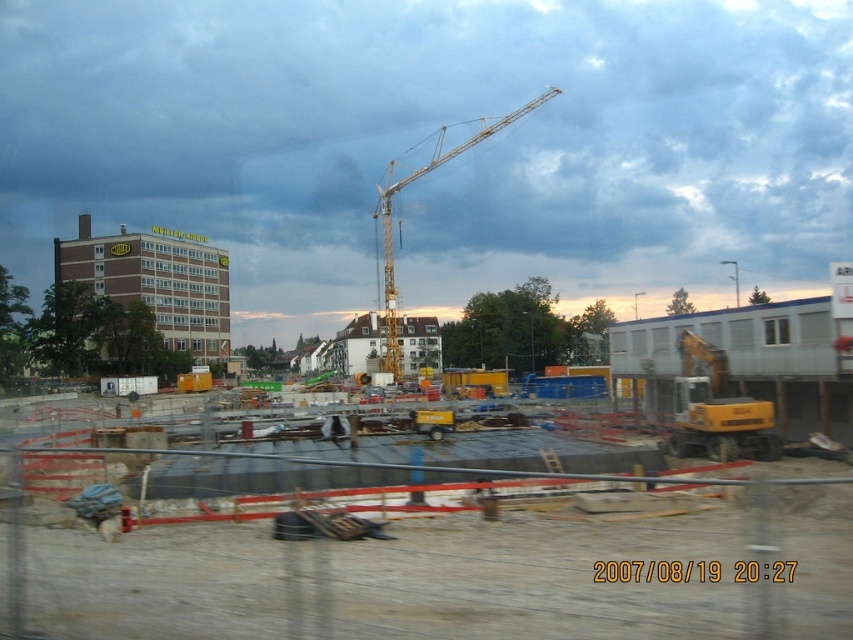
Question: Based on their relative distances, which object is farther from the black plastic website at center?

Choices:
 (A) brown brick building at left
 (B) yellow metallic truck at center

Answer: (A)

Question: Which point is farther to the camera?

Choices:
 (A) (178, 241)
 (B) (686, 579)
 (C) (543, 93)
 (D) (396, 611)

Answer: (C)

Question: Where is yellow metallic truck at center located in relation to black plastic website at center in the image?

Choices:
 (A) right
 (B) left

Answer: (B)

Question: Which of these objects is positioned farthest from the brown brick building at left?

Choices:
 (A) black plastic website at center
 (B) yellow metallic truck at center
 (C) yellow metallic crane at center

Answer: (A)

Question: Can you confirm if yellow metallic truck at center is thinner than black plastic website at center?

Choices:
 (A) yes
 (B) no

Answer: (B)

Question: Is the position of yellow metallic truck at center more distant than that of yellow metallic crane at center?

Choices:
 (A) yes
 (B) no

Answer: (B)